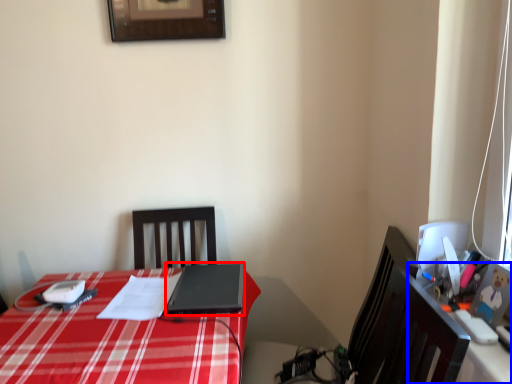
Question: Which of the following is the closest to the observer, laptop (highlighted by a red box) or computer desk (highlighted by a blue box)?

Choices:
 (A) laptop
 (B) computer desk

Answer: (B)